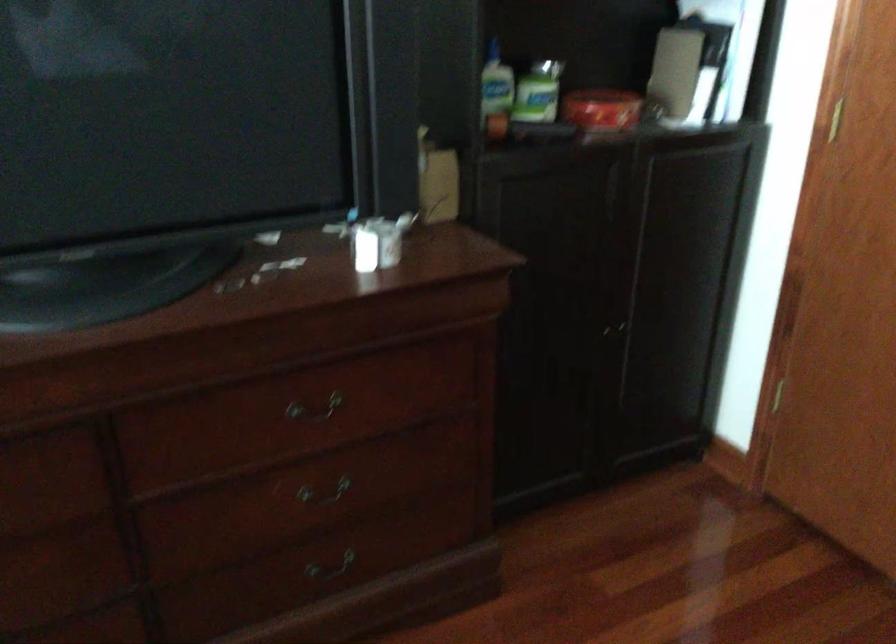
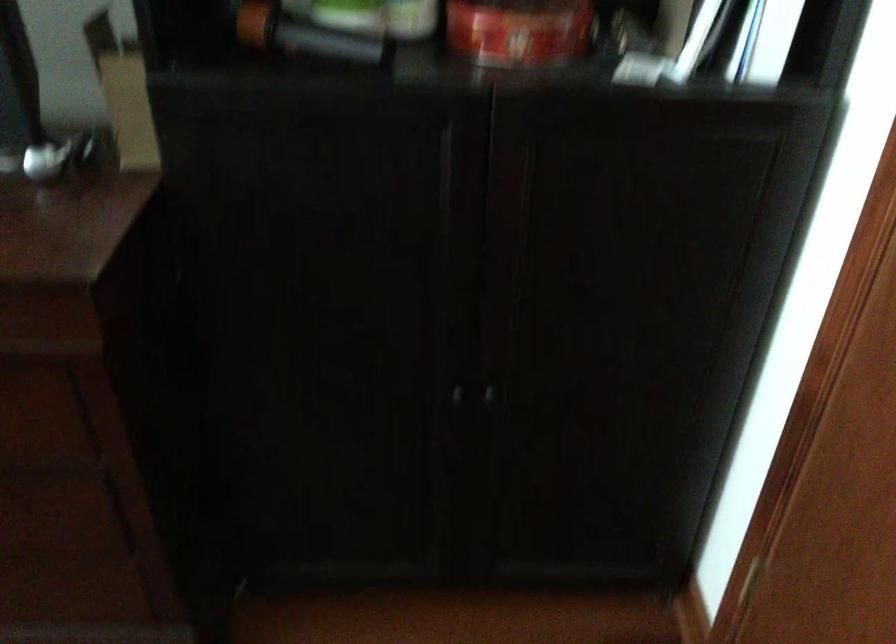
Find the pixel in the second image that matches point 618,114 in the first image.

(519, 31)